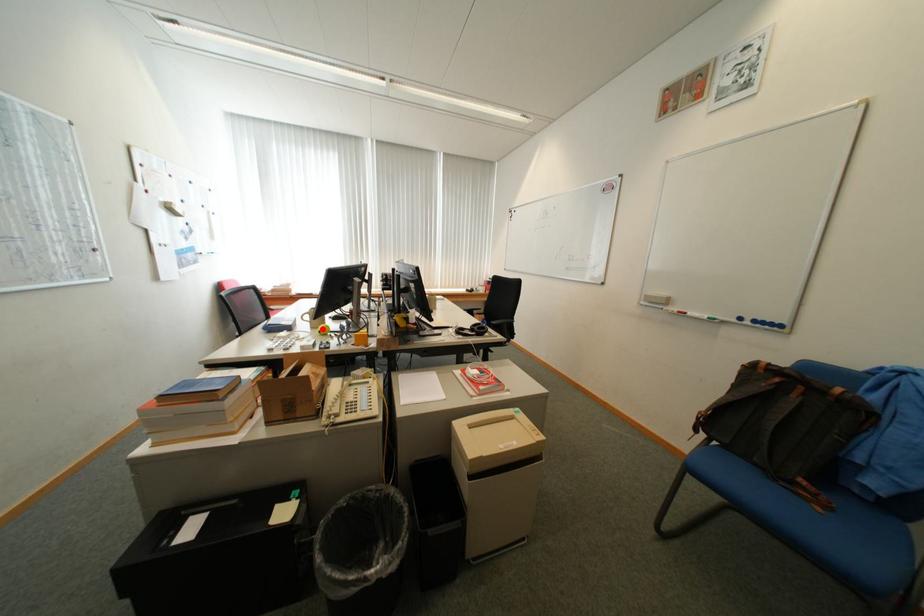
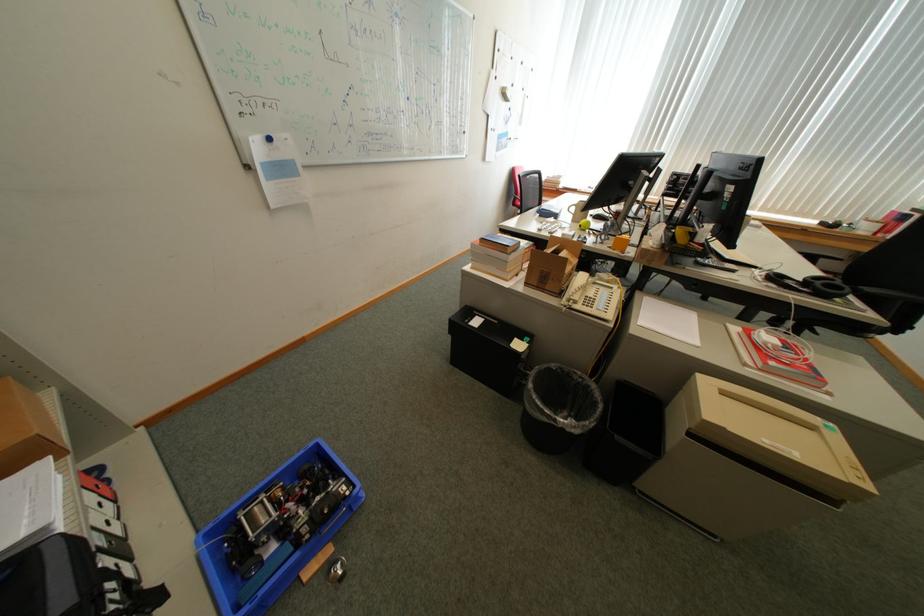
Locate, in the second image, the point that corresponds to the highlighted location in the first image.

(582, 223)